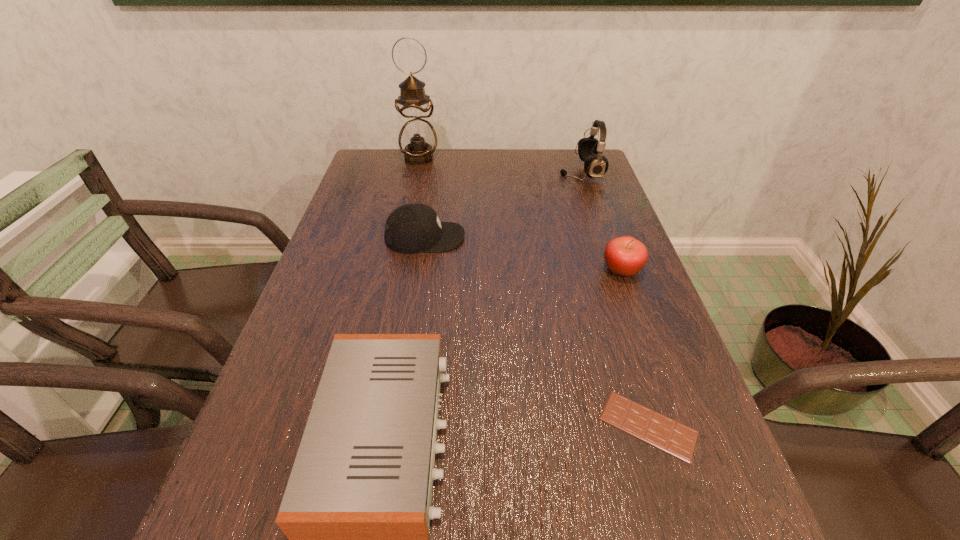
Identify the location of the tallest object. This screenshot has height=540, width=960. (417, 136).

Locate an element on the screen. the second tallest object is located at coordinates (590, 150).

The image size is (960, 540). Find the location of `the third farthest object`. the third farthest object is located at coordinates (412, 228).

Where is `the third nearest object`? The image size is (960, 540). the third nearest object is located at coordinates (625, 256).

Locate an element on the screen. This screenshot has height=540, width=960. chocolate bar is located at coordinates (662, 432).

Locate an element on the screen. vacant point located 0.160m on the front of the tallest object is located at coordinates (412, 193).

Where is `free space located with the microphone on the side of the headset`? Image resolution: width=960 pixels, height=540 pixels. free space located with the microphone on the side of the headset is located at coordinates (524, 172).

This screenshot has height=540, width=960. What are the coordinates of `vacant space located 0.300m with the microphone on the side of the headset` in the screenshot? It's located at (464, 172).

Identify the location of free spot located with the microphone on the side of the headset. This screenshot has height=540, width=960. (451, 172).

The width and height of the screenshot is (960, 540). I want to click on vacant space located 0.100m on the front-facing side of the third farthest object, so click(504, 238).